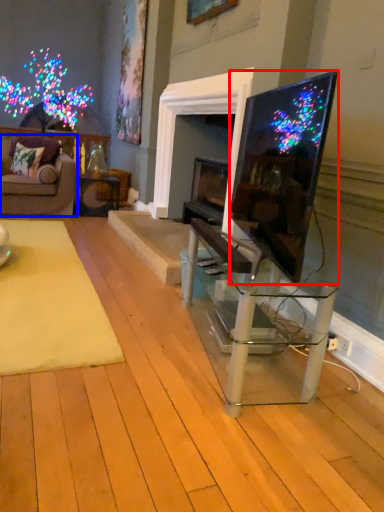
Question: Which object appears farthest to the camera in this image, television (highlighted by a red box) or studio couch (highlighted by a blue box)?

Choices:
 (A) television
 (B) studio couch

Answer: (B)